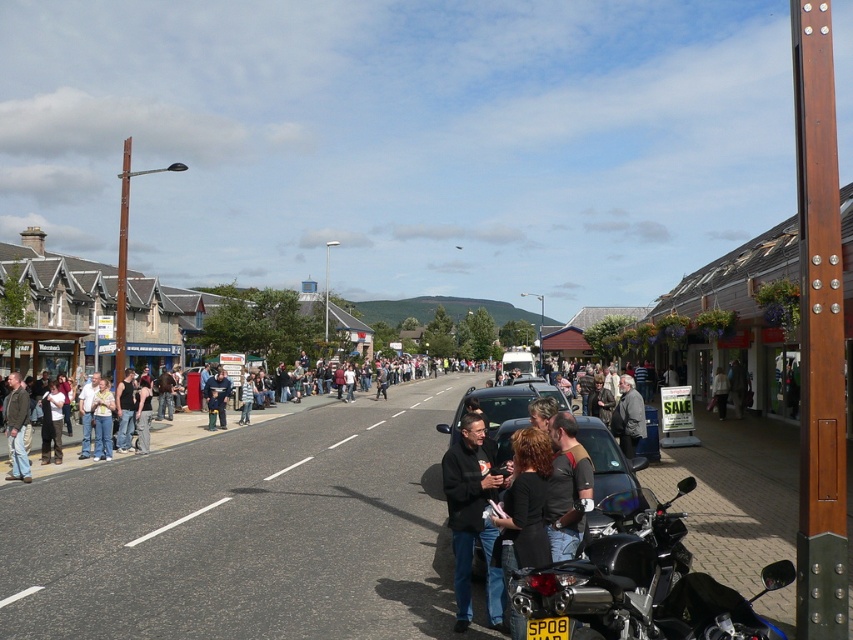
Question: Observing the image, what is the correct spatial positioning of dark gray jacket at center in reference to denim jeans at left?

Choices:
 (A) left
 (B) right

Answer: (B)

Question: Is dark gray clothing at center above denim jacket at left?

Choices:
 (A) yes
 (B) no

Answer: (B)

Question: Which of these objects is positioned closest to the light brown leather jacket at center?

Choices:
 (A) jeans at center
 (B) denim jacket at left
 (C) black glossy car at center

Answer: (C)

Question: Among these objects, which one is farthest from the camera?

Choices:
 (A) denim jeans at left
 (B) dark gray jacket at center
 (C) light brown leather jacket at center

Answer: (C)

Question: Does black glossy car at center have a larger size compared to denim jeans at left?

Choices:
 (A) no
 (B) yes

Answer: (B)

Question: Which point is farther from the camera taking this photo?

Choices:
 (A) (105, 390)
 (B) (619, 416)

Answer: (A)